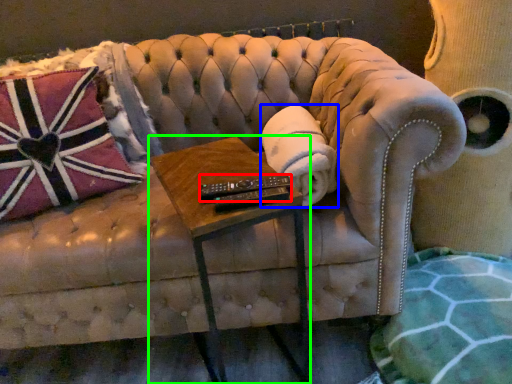
Question: Estimate the real-world distances between objects in this image. Which object is farther from control (highlighted by a red box), material (highlighted by a blue box) or table (highlighted by a green box)?

Choices:
 (A) material
 (B) table

Answer: (A)